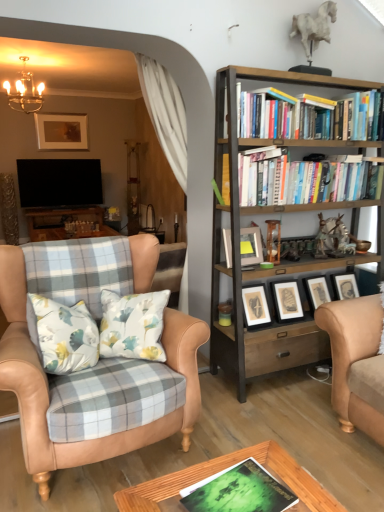
Question: Considering the positions of metallic chandelier at upper left and hardcover books at upper right, the second book in the left-to-right sequence, in the image, is metallic chandelier at upper left wider or thinner than hardcover books at upper right, the second book in the left-to-right sequence,?

Choices:
 (A) wide
 (B) thin

Answer: (A)

Question: From the image's perspective, is metallic chandelier at upper left located above or below hardcover books at upper right, arranged as the second book when viewed from the front?

Choices:
 (A) below
 (B) above

Answer: (B)

Question: Estimate the real-world distances between objects in this image. Which object is farther from the hardcover books at upper right, arranged as the second book when viewed from the front?

Choices:
 (A) green matte book at center, marked as the 1th book in a left-to-right arrangement
 (B) metallic chandelier at upper left
 (C) wooden bookshelf at right
 (D) matte gray picture frame at center, which is the 1th picture frame from right to left
 (E) matte gold picture frame at upper center, placed as the second picture frame when sorted from right to left

Answer: (E)

Question: Which of these objects is positioned farthest from the wooden bookshelf at right?

Choices:
 (A) matte gold picture frame at upper center, the first picture frame viewed from the left
 (B) hardcover books at upper right, placed as the first book when sorted from right to left
 (C) matte gray picture frame at center, which is the 1th picture frame from right to left
 (D) tan leather chair at left
 (E) green matte book at center, marked as the 1th book in a left-to-right arrangement

Answer: (A)